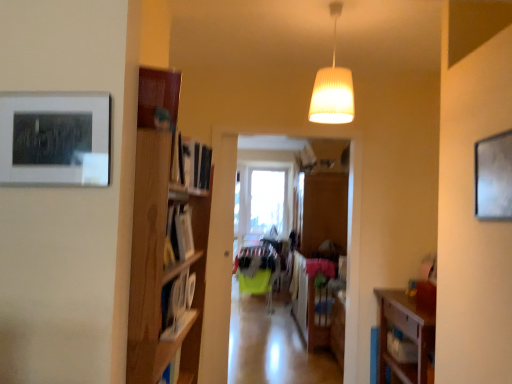
Question: Is matte black picture frame at upper left, which is the first picture frame from front to back, located outside matte gray picture frame at upper right, which ranks as the second picture frame in front-to-back order?

Choices:
 (A) no
 (B) yes

Answer: (B)

Question: Is matte black picture frame at upper left, which appears as the 1th picture frame when viewed from the left, positioned behind matte gray picture frame at upper right, placed as the first picture frame when sorted from back to front?

Choices:
 (A) no
 (B) yes

Answer: (A)

Question: Does matte black picture frame at upper left, which is the first picture frame from front to back, have a smaller size compared to matte gray picture frame at upper right, placed as the first picture frame when sorted from back to front?

Choices:
 (A) no
 (B) yes

Answer: (B)

Question: Is matte black picture frame at upper left, positioned as the 2th picture frame in back-to-front order, wider than matte gray picture frame at upper right, marked as the 2th picture frame in a left-to-right arrangement?

Choices:
 (A) yes
 (B) no

Answer: (A)

Question: Does matte black picture frame at upper left, positioned as the 2th picture frame in back-to-front order, appear on the left side of matte gray picture frame at upper right, which ranks as the second picture frame in front-to-back order?

Choices:
 (A) no
 (B) yes

Answer: (B)

Question: Does matte black picture frame at upper left, which appears as the 1th picture frame when viewed from the left, lie in front of matte gray picture frame at upper right, which appears as the first picture frame when viewed from the right?

Choices:
 (A) no
 (B) yes

Answer: (B)

Question: Does transparent glass window at center have a smaller size compared to green fabric chair at center?

Choices:
 (A) no
 (B) yes

Answer: (B)

Question: Can you confirm if transparent glass window at center is thinner than green fabric chair at center?

Choices:
 (A) yes
 (B) no

Answer: (A)

Question: Is transparent glass window at center oriented away from green fabric chair at center?

Choices:
 (A) yes
 (B) no

Answer: (B)

Question: Considering the relative positions of transparent glass window at center and green fabric chair at center in the image provided, is transparent glass window at center to the right of green fabric chair at center from the viewer's perspective?

Choices:
 (A) yes
 (B) no

Answer: (A)

Question: From the image's perspective, would you say transparent glass window at center is shown under green fabric chair at center?

Choices:
 (A) no
 (B) yes

Answer: (A)

Question: Can you confirm if transparent glass window at center is shorter than green fabric chair at center?

Choices:
 (A) yes
 (B) no

Answer: (B)

Question: Does wooden floor at center have a lesser height compared to matte black picture frame at upper left, which appears as the 1th picture frame when viewed from the left?

Choices:
 (A) yes
 (B) no

Answer: (A)